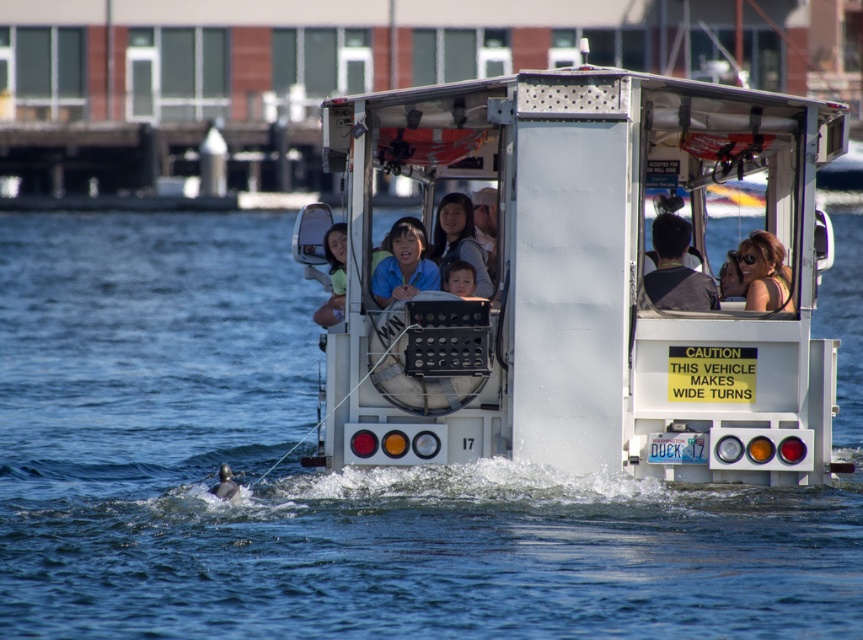
Question: Which point is farther to the camera?

Choices:
 (A) (164, 480)
 (B) (476, 256)

Answer: (A)

Question: Can you confirm if clear blue water at center is thinner than matte black sunglasses at center?

Choices:
 (A) no
 (B) yes

Answer: (A)

Question: Can you confirm if dark gray fabric at center is bigger than blue matte shirt at center?

Choices:
 (A) yes
 (B) no

Answer: (A)

Question: Estimate the real-world distances between objects in this image. Which object is farther from the dark gray fabric at center?

Choices:
 (A) smooth skin face at center
 (B) matte blue shirt at center
 (C) matte black sunglasses at center
 (D) blue matte shirt at center

Answer: (B)

Question: Does white metallic boat at center have a smaller size compared to matte black sunglasses at center?

Choices:
 (A) no
 (B) yes

Answer: (B)

Question: Which object appears closest to the camera in this image?

Choices:
 (A) matte blue shirt at center
 (B) dark gray fabric at center
 (C) smooth skin face at center
 (D) matte black sunglasses at center

Answer: (D)